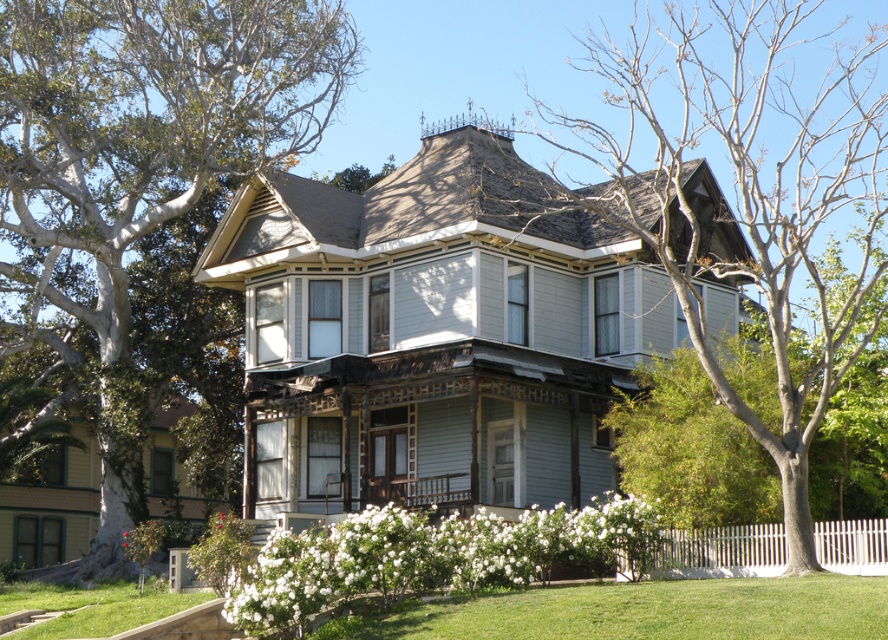
Which is below, smooth gray bark at upper left or green grass at lower center?

green grass at lower center is below.

Is point (102, 568) farther from camera compared to point (687, 618)?

Yes, it is behind point (687, 618).

Between point (274, 132) and point (789, 593), which one is positioned behind?

Point (274, 132)

Identify the location of smooth gray bark at upper left. (139, 168).

Between point (843, 244) and point (883, 532), which one is positioned behind?

Point (843, 244)

Which is in front, point (639, 164) or point (778, 564)?

Point (778, 564) is in front.

Where is `bare branches at upper center`? The image size is (888, 640). bare branches at upper center is located at coordinates (750, 195).

Between smooth gray bark at upper left and bare branches at upper center, which one appears on the left side from the viewer's perspective?

Positioned to the left is smooth gray bark at upper left.

Consider the image. Can you confirm if smooth gray bark at upper left is wider than bare branches at upper center?

No, smooth gray bark at upper left is not wider than bare branches at upper center.

Where is `smooth gray bark at upper left`? This screenshot has width=888, height=640. smooth gray bark at upper left is located at coordinates (139, 168).